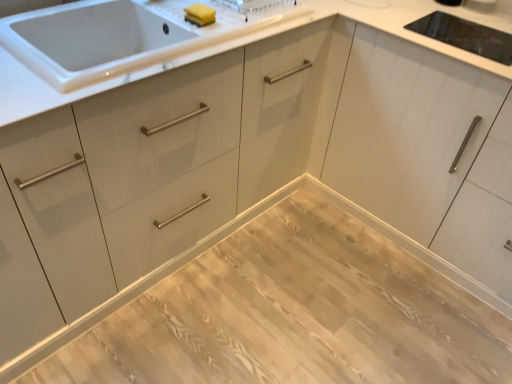
At what (x,y) coordinates should I click in order to perform the action: click on free location to the left of yellow sponge at upper center. Please return your answer as a coordinate pair (x, y). The height and width of the screenshot is (384, 512). Looking at the image, I should click on (167, 13).